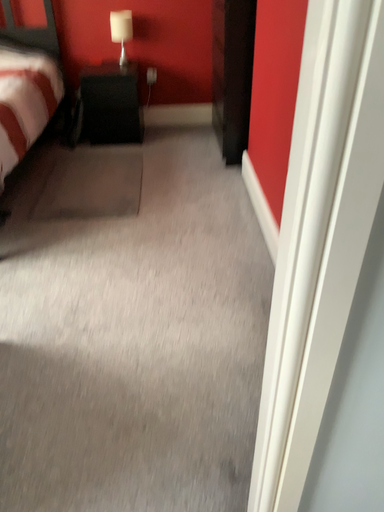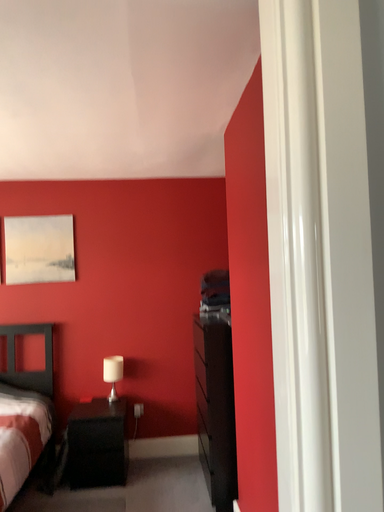
Question: How did the camera likely rotate when shooting the video?

Choices:
 (A) rotated upward
 (B) rotated downward

Answer: (A)